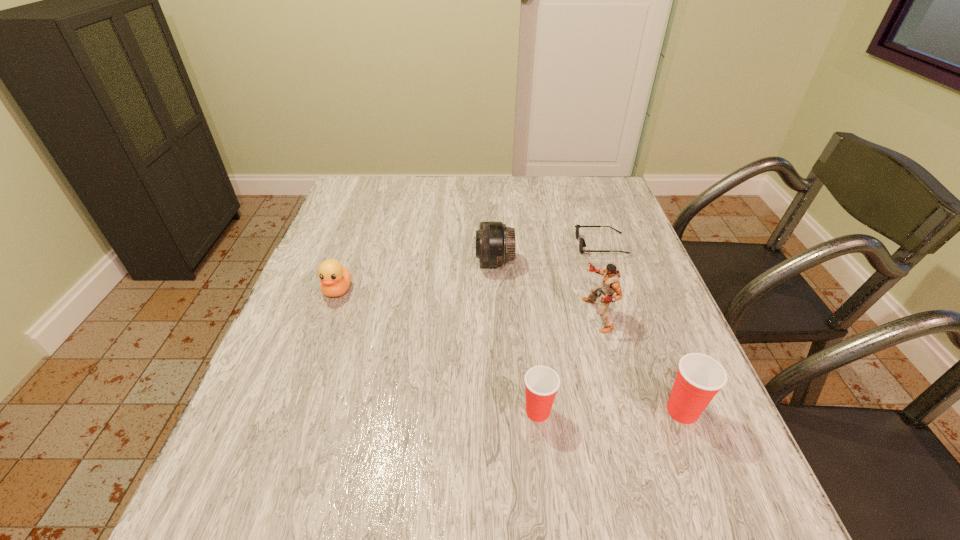
Identify the location of sunglasses located in the right edge section of the desktop. This screenshot has width=960, height=540. (582, 243).

The height and width of the screenshot is (540, 960). Identify the location of puncher positioned at the right edge. (610, 283).

You are a GUI agent. You are given a task and a screenshot of the screen. Output one action in this format:
    pyautogui.click(x=<x>, y=<y>)
    Task: Click on the object positioned at the near right corner
    Image resolution: width=960 pixels, height=540 pixels.
    Given the screenshot: What is the action you would take?
    pyautogui.click(x=699, y=378)

In the image, there is a desktop. Where is `vacant area at the far edge`? vacant area at the far edge is located at coordinates (439, 194).

In the image, there is a desktop. At what (x,y) coordinates should I click in order to perform the action: click on vacant region at the left edge. Please return your answer as a coordinate pair (x, y). Looking at the image, I should click on (302, 385).

This screenshot has width=960, height=540. In the image, there is a desktop. Find the location of `free region at the right edge`. free region at the right edge is located at coordinates (612, 318).

Find the location of `blank space at the far right corner of the desktop`. blank space at the far right corner of the desktop is located at coordinates (x=620, y=198).

Identify the location of vacant point located between the left Dixie cup and the telephoto lens. The height and width of the screenshot is (540, 960). (516, 336).

This screenshot has height=540, width=960. In order to click on unoccupied area between the sunglasses and the left Dixie cup in this screenshot , I will do `click(569, 328)`.

The image size is (960, 540). I want to click on free space between the puncher and the shortest object, so click(x=599, y=280).